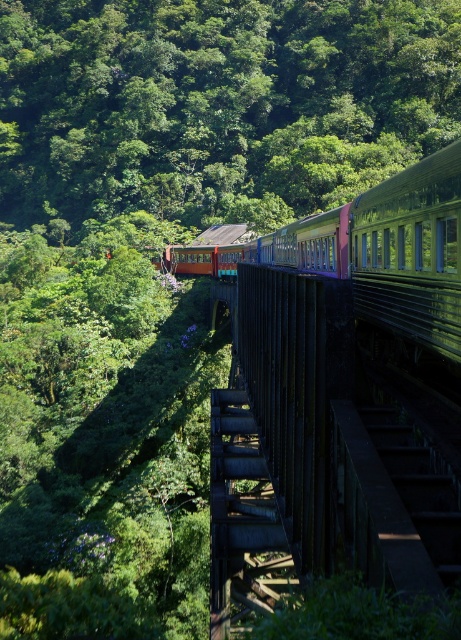
You are a photographer standing at the camera position in the scene. You want to capture a photo of the green leafy tree at upper center. The camera has a focal length of 100mm and a sensor size of 24mm. What is the angular field of view required to fully frame the tree?

The green leafy tree at upper center is 89.36 meters away from the camera. Using the formula for angular field of view, which is 2 times arctangent of half the sensor size divided by focal length, the calculation would be 2 arctan 24mm divided by 2 times 100mm. This results in an angular field of view of approximately 2.86 degrees. However, since the tree is 89.36 meters away, the actual angle needed to frame it would depend on the tree height. Without the tree height, we cannot accurately determine the FOV

Based on the photo, you are a photographer aiming to capture the entire view of the dark brown wooden bridge at center without any obstructions. However, there is a green leafy tree at upper center in the way. Based on their sizes, which object would you need to adjust your camera angle to avoid?

The green leafy tree at upper center has a larger width than the dark brown wooden bridge at center, so you should adjust your camera angle to avoid the green leafy tree at upper center to capture the bridge without obstruction.

You are a passenger on the train and looking out the window. There are two points marked on the window, one at coordinate point [325,54] and the other at point [296,300]. Which point is closer to you?

Point [296,300] is closer to you because it is less further to the camera than point [325,54].